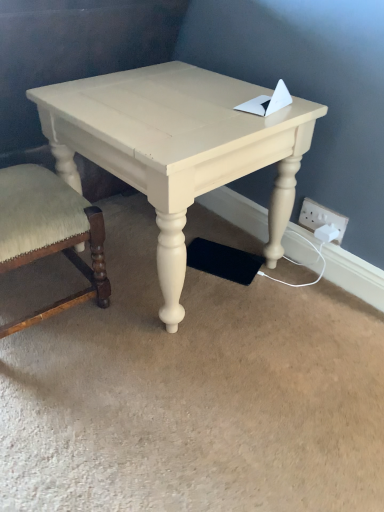
Question: From a real-world perspective, is matte cream table at center beneath velvet beige chair at lower left?

Choices:
 (A) no
 (B) yes

Answer: (A)

Question: From the image's perspective, is matte cream table at center on top of velvet beige chair at lower left?

Choices:
 (A) no
 (B) yes

Answer: (B)

Question: Does matte cream table at center have a greater width compared to velvet beige chair at lower left?

Choices:
 (A) yes
 (B) no

Answer: (A)

Question: Does matte cream table at center have a lesser width compared to velvet beige chair at lower left?

Choices:
 (A) no
 (B) yes

Answer: (A)

Question: Is velvet beige chair at lower left surrounded by matte cream table at center?

Choices:
 (A) yes
 (B) no

Answer: (B)

Question: Considering their positions, is matte cream table at center located in front of or behind white plastic electric outlet at lower right?

Choices:
 (A) front
 (B) behind

Answer: (A)

Question: In terms of height, does matte cream table at center look taller or shorter compared to white plastic electric outlet at lower right?

Choices:
 (A) short
 (B) tall

Answer: (B)

Question: Does point (56, 129) appear closer or farther from the camera than point (301, 212)?

Choices:
 (A) closer
 (B) farther

Answer: (A)

Question: From a real-world perspective, is matte cream table at center above or below white plastic electric outlet at lower right?

Choices:
 (A) below
 (B) above

Answer: (B)

Question: Considering their positions, is white plastic electric outlet at lower right located in front of or behind velvet beige chair at lower left?

Choices:
 (A) front
 (B) behind

Answer: (B)

Question: Does point (311, 203) appear closer or farther from the camera than point (51, 239)?

Choices:
 (A) farther
 (B) closer

Answer: (A)

Question: Based on their positions, is white plastic electric outlet at lower right located to the left or right of velvet beige chair at lower left?

Choices:
 (A) left
 (B) right

Answer: (B)

Question: From a real-world perspective, is white plastic electric outlet at lower right physically located above or below velvet beige chair at lower left?

Choices:
 (A) above
 (B) below

Answer: (A)

Question: Is velvet beige chair at lower left in front of or behind white plastic electric outlet at lower right in the image?

Choices:
 (A) front
 (B) behind

Answer: (A)

Question: In terms of height, does velvet beige chair at lower left look taller or shorter compared to white plastic electric outlet at lower right?

Choices:
 (A) tall
 (B) short

Answer: (A)